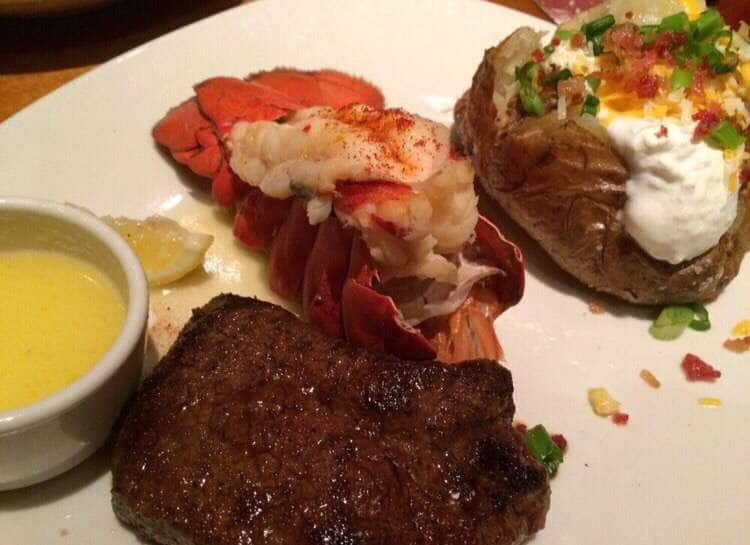
Locate an element on the screen. white bowl is located at coordinates (55, 454).